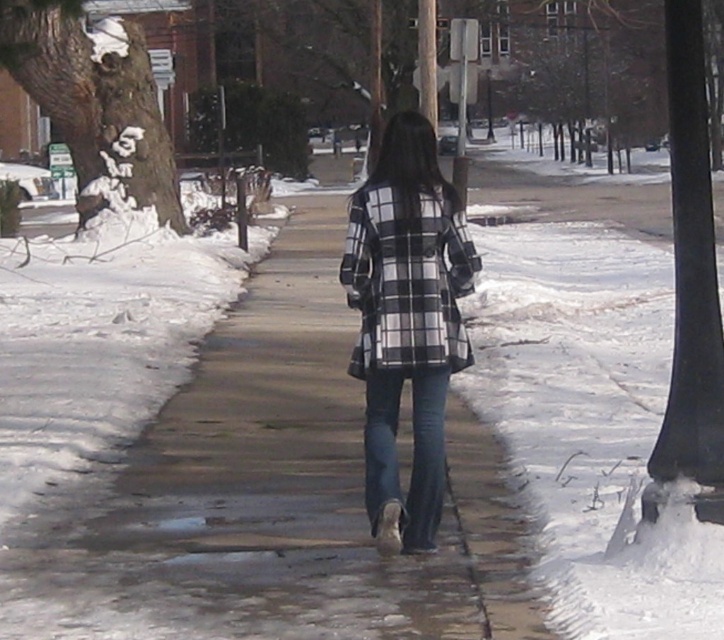
Question: Is black checkered coat at center below blue denim jeans at center?

Choices:
 (A) yes
 (B) no

Answer: (B)

Question: Can you confirm if black smooth pole at right is bigger than blue denim jeans at center?

Choices:
 (A) no
 (B) yes

Answer: (B)

Question: Which point is closer to the camera?

Choices:
 (A) black checkered coat at center
 (B) blue denim jeans at center
 (C) black smooth pole at right
 (D) plaid fabric coat at center

Answer: (C)

Question: Which point appears closest to the camera in this image?

Choices:
 (A) (378, 358)
 (B) (710, 444)

Answer: (B)

Question: Is the position of black checkered coat at center more distant than that of blue denim jeans at center?

Choices:
 (A) no
 (B) yes

Answer: (B)

Question: Which point is farther to the camera?

Choices:
 (A) (382, 483)
 (B) (681, 390)
 (C) (416, 369)
 (D) (382, 449)

Answer: (D)